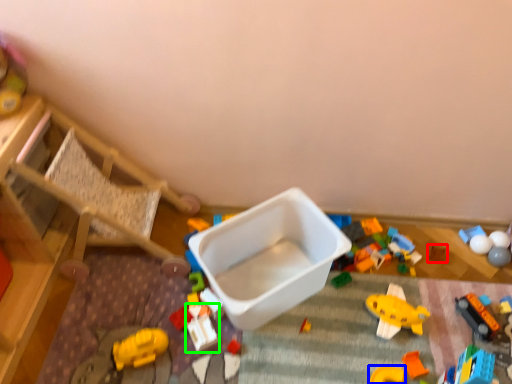
Question: Which object is the closest to the toy (highlighted by a red box)? Choose among these: toy (highlighted by a blue box) or toy (highlighted by a green box).

Choices:
 (A) toy
 (B) toy

Answer: (A)